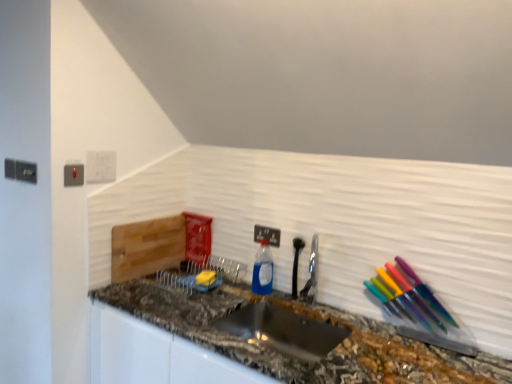
Locate an element on the screen. blue translucent bottle at center is located at coordinates (263, 271).

Measure the distance between point (77,172) and camera.

Point (77,172) and camera are 1.84 meters apart.

What do you see at coordinates (100, 166) in the screenshot? The width and height of the screenshot is (512, 384). I see `white plastic light switch at upper left` at bounding box center [100, 166].

Measure the distance between satin nickel faucet at center and camera.

satin nickel faucet at center and camera are 6.13 feet apart.

Where is `marble granite countertop at center`? The width and height of the screenshot is (512, 384). marble granite countertop at center is located at coordinates (298, 360).

I want to click on the 2nd electric outlet positioned above the satin nickel faucet at center (from the image's perspective), so click(73, 175).

Is satin nickel faucet at center completely or partially inside matte gray electric outlet at upper left, which appears as the 1th electric outlet when viewed from the left?

No.

Is matte gray electric outlet at upper left, the 2th electric outlet from the right, oriented towards satin nickel faucet at center?

No, matte gray electric outlet at upper left, the 2th electric outlet from the right, is not aimed at satin nickel faucet at center.

Is the position of matte gray electric outlet at upper left, which appears as the 1th electric outlet when viewed from the left, less distant than that of satin nickel faucet at center?

That is True.

Is the position of white plastic electric outlet at center, the 2th electric outlet positioned from the left, more distant than that of stainless steel sink at center?

Yes, white plastic electric outlet at center, the 2th electric outlet positioned from the left, is further from the camera.

Considering the positions of objects white plastic electric outlet at center, the 2th electric outlet positioned from the left, and stainless steel sink at center in the image provided, who is more to the right, white plastic electric outlet at center, the 2th electric outlet positioned from the left, or stainless steel sink at center?

stainless steel sink at center.

Locate an element on the screen. The height and width of the screenshot is (384, 512). sink in front of the white plastic electric outlet at center, the 2th electric outlet positioned from the left is located at coordinates (282, 330).

What's the angular difference between white plastic electric outlet at center, which is counted as the 1th electric outlet, starting from the right, and stainless steel sink at center's facing directions?

white plastic electric outlet at center, which is counted as the 1th electric outlet, starting from the right, and stainless steel sink at center are facing 0.0428 degrees away from each other.

Which object is positioned more to the left, blue translucent bottle at center or white plastic light switch at upper left?

white plastic light switch at upper left.

Is blue translucent bottle at center with white plastic light switch at upper left?

blue translucent bottle at center and white plastic light switch at upper left are not in contact.

Can you tell me how much blue translucent bottle at center and white plastic light switch at upper left differ in facing direction?

The angle between the facing direction of blue translucent bottle at center and the facing direction of white plastic light switch at upper left is 90.3 degrees.

Does blue translucent bottle at center have a smaller size compared to white plastic light switch at upper left?

Incorrect, blue translucent bottle at center is not smaller in size than white plastic light switch at upper left.

Is matte gray electric outlet at upper left, arranged as the first electric outlet when viewed from the front, to the left of marble granite countertop at center from the viewer's perspective?

Yes, matte gray electric outlet at upper left, arranged as the first electric outlet when viewed from the front, is to the left of marble granite countertop at center.

Image resolution: width=512 pixels, height=384 pixels. Find the location of `the 1st electric outlet behind the marble granite countertop at center, starting your count from the anchor`. the 1st electric outlet behind the marble granite countertop at center, starting your count from the anchor is located at coordinates (73, 175).

From the image's perspective, between matte gray electric outlet at upper left, which appears as the 1th electric outlet when viewed from the left, and marble granite countertop at center, which one is located above?

matte gray electric outlet at upper left, which appears as the 1th electric outlet when viewed from the left, is shown above in the image.

Is matte gray electric outlet at upper left, arranged as the first electric outlet when viewed from the top, facing towards marble granite countertop at center?

No, matte gray electric outlet at upper left, arranged as the first electric outlet when viewed from the top, does not turn towards marble granite countertop at center.

Between stainless steel sink at center and blue translucent bottle at center, which one has smaller size?

With smaller size is blue translucent bottle at center.

Does stainless steel sink at center turn towards blue translucent bottle at center?

No.

Which point is more forward, (255,328) or (258,280)?

The point (255,328) is more forward.

Considering the relative sizes of white plastic light switch at upper left and matte gray electric outlet at upper left, which appears as the 1th electric outlet when viewed from the left, in the image provided, is white plastic light switch at upper left thinner than matte gray electric outlet at upper left, which appears as the 1th electric outlet when viewed from the left,?

Yes, white plastic light switch at upper left is thinner than matte gray electric outlet at upper left, which appears as the 1th electric outlet when viewed from the left.

Is white plastic light switch at upper left next to matte gray electric outlet at upper left, the second electric outlet in the back-to-front sequence?

Absolutely, white plastic light switch at upper left is next to and touching matte gray electric outlet at upper left, the second electric outlet in the back-to-front sequence.

From a real-world perspective, who is located higher, white plastic light switch at upper left or matte gray electric outlet at upper left, the 2th electric outlet from the right?

white plastic light switch at upper left is physically above.

Considering the relative sizes of marble granite countertop at center and white plastic electric outlet at center, placed as the second electric outlet when sorted from top to bottom, in the image provided, is marble granite countertop at center taller than white plastic electric outlet at center, placed as the second electric outlet when sorted from top to bottom,?

Yes, marble granite countertop at center is taller than white plastic electric outlet at center, placed as the second electric outlet when sorted from top to bottom.

From the image's perspective, which one is positioned lower, marble granite countertop at center or white plastic electric outlet at center, which is counted as the 1th electric outlet, starting from the right?

marble granite countertop at center.

Is point (211, 302) closer or farther from the camera than point (277, 241)?

Point (211, 302) is closer to the camera than point (277, 241).

Does marble granite countertop at center touch white plastic electric outlet at center, marked as the first electric outlet in a back-to-front arrangement?

No, marble granite countertop at center is not with white plastic electric outlet at center, marked as the first electric outlet in a back-to-front arrangement.

In order to click on faucet on the right side of matte gray electric outlet at upper left, arranged as the first electric outlet when viewed from the top in this screenshot , I will do `click(311, 274)`.

Locate an element on the screen. This screenshot has width=512, height=384. sink below the white plastic electric outlet at center, which is counted as the 1th electric outlet, starting from the right (from the image's perspective) is located at coordinates (282, 330).

Estimate the real-world distances between objects in this image. Which object is closer to satin nickel faucet at center, white plastic electric outlet at center, which ranks as the 1th electric outlet in bottom-to-top order, or blue translucent bottle at center?

Among the two, blue translucent bottle at center is located nearer to satin nickel faucet at center.

In the scene shown: Estimate the real-world distances between objects in this image. Which object is closer to matte gray electric outlet at upper left, acting as the second electric outlet starting from the bottom, satin nickel faucet at center or stainless steel sink at center?

stainless steel sink at center lies closer to matte gray electric outlet at upper left, acting as the second electric outlet starting from the bottom, than the other object.

When comparing their distances from marble granite countertop at center, does satin nickel faucet at center or white plastic electric outlet at center, which is counted as the 1th electric outlet, starting from the right, seem closer?

satin nickel faucet at center is closer to marble granite countertop at center.

Estimate the real-world distances between objects in this image. Which object is further from white plastic electric outlet at center, placed as the second electric outlet when sorted from top to bottom, white plastic light switch at upper left or satin nickel faucet at center?

The object further to white plastic electric outlet at center, placed as the second electric outlet when sorted from top to bottom, is white plastic light switch at upper left.

From the image, which object appears to be nearer to stainless steel sink at center, blue translucent bottle at center or white plastic electric outlet at center, the 2th electric outlet when ordered from front to back?

Based on the image, blue translucent bottle at center appears to be nearer to stainless steel sink at center.

Estimate the real-world distances between objects in this image. Which object is further from white plastic electric outlet at center, the 2th electric outlet when ordered from front to back, satin nickel faucet at center or matte gray electric outlet at upper left, the 2th electric outlet from the right?

matte gray electric outlet at upper left, the 2th electric outlet from the right, lies further to white plastic electric outlet at center, the 2th electric outlet when ordered from front to back, than the other object.

Considering their positions, is satin nickel faucet at center positioned closer to blue translucent bottle at center than matte gray electric outlet at upper left, the 2th electric outlet from the right?

Based on the image, satin nickel faucet at center appears to be nearer to blue translucent bottle at center.

Based on their spatial positions, is satin nickel faucet at center or white plastic electric outlet at center, which is counted as the 1th electric outlet, starting from the right, closer to blue translucent bottle at center?

white plastic electric outlet at center, which is counted as the 1th electric outlet, starting from the right.

The width and height of the screenshot is (512, 384). I want to click on faucet located between stainless steel sink at center and white plastic electric outlet at center, the 2th electric outlet positioned from the left, in the depth direction, so click(311, 274).

What are the coordinates of `sink between marble granite countertop at center and blue translucent bottle at center along the z-axis` in the screenshot? It's located at (282, 330).

Locate an element on the screen. This screenshot has height=384, width=512. electric outlet situated between matte gray electric outlet at upper left, acting as the second electric outlet starting from the bottom, and satin nickel faucet at center from left to right is located at coordinates (267, 235).

What are the coordinates of `bottle located between marble granite countertop at center and white plastic electric outlet at center, the 2th electric outlet when ordered from front to back, in the depth direction` in the screenshot? It's located at (263, 271).